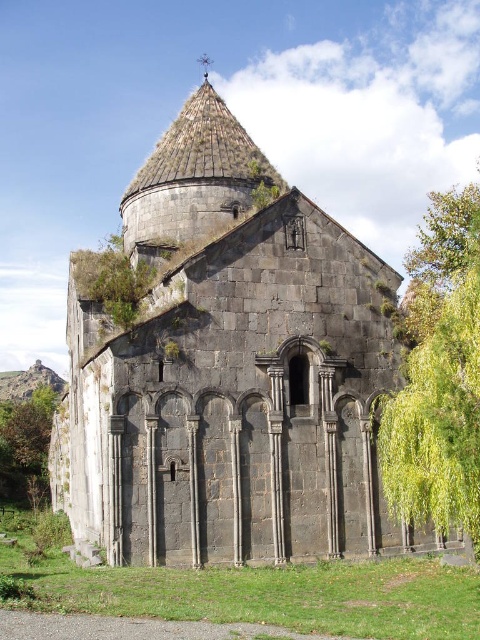
Question: Estimate the real-world distances between objects in this image. Which object is closer to the green leafy tree at lower left?

Choices:
 (A) dark gray stone church at center
 (B) green leafy tree at right

Answer: (A)

Question: Does dark gray stone church at center have a smaller size compared to green leafy tree at lower left?

Choices:
 (A) yes
 (B) no

Answer: (B)

Question: Among these points, which one is nearest to the camera?

Choices:
 (A) (456, 387)
 (B) (9, 403)

Answer: (A)

Question: Does green leafy tree at right have a smaller size compared to green leafy tree at lower left?

Choices:
 (A) yes
 (B) no

Answer: (B)

Question: Can you confirm if green leafy tree at right is positioned below green leafy tree at lower left?

Choices:
 (A) yes
 (B) no

Answer: (B)

Question: Which point appears farthest from the camera in this image?

Choices:
 (A) 117,452
 (B) 6,477

Answer: (B)